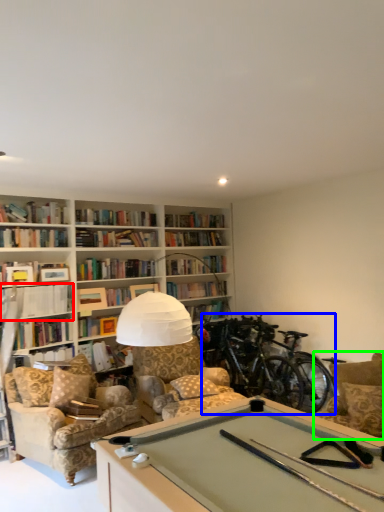
Question: Which object is positioned farthest from book (highlighted by a red box)? Select from bicycle (highlighted by a blue box) and armchair (highlighted by a green box).

Choices:
 (A) bicycle
 (B) armchair

Answer: (B)